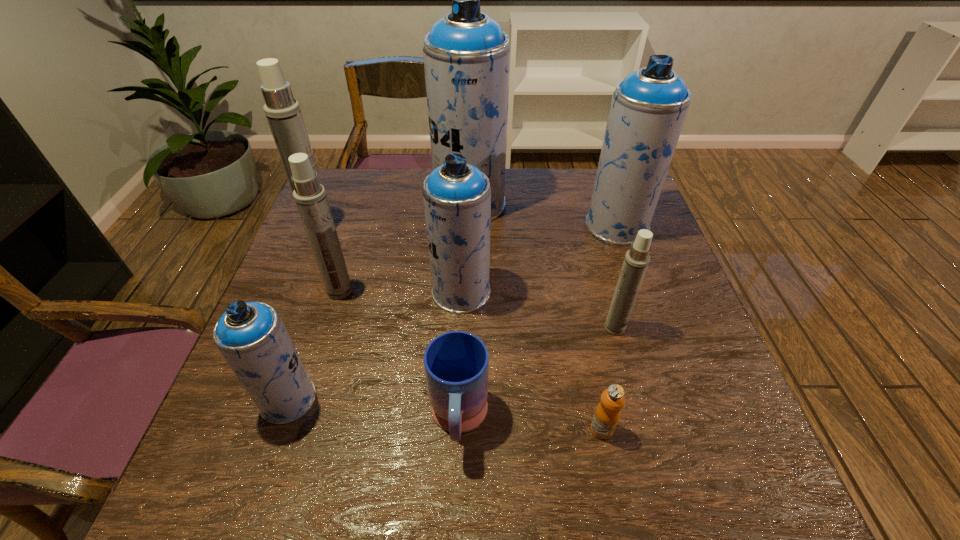
You are a GUI agent. You are given a task and a screenshot of the screen. Output one action in this format:
    pyautogui.click(x=<x>, y=<y>)
    Task: Click on the tallest aerosol can
    The image size is (960, 540).
    Given the screenshot: What is the action you would take?
    pyautogui.click(x=466, y=54)

Identify the location of the biggest blue aerosol can. (466, 54).

Find the location of a particular element. This screenshot has width=960, height=540. the farthest white aerosol can is located at coordinates (283, 113).

The width and height of the screenshot is (960, 540). What are the coordinates of `the leftmost white aerosol can` in the screenshot? It's located at (283, 113).

Locate an element on the screen. the second biggest blue aerosol can is located at coordinates (648, 109).

Find the location of `the second white aerosol can from left to right`. the second white aerosol can from left to right is located at coordinates (310, 197).

Where is `the second farthest white aerosol can`? The height and width of the screenshot is (540, 960). the second farthest white aerosol can is located at coordinates (310, 197).

The height and width of the screenshot is (540, 960). In order to click on the second smallest blue aerosol can in this screenshot , I will do `click(457, 196)`.

At what (x,y) coordinates should I click in order to perform the action: click on the smallest white aerosol can. Please return your answer as a coordinate pair (x, y). The height and width of the screenshot is (540, 960). Looking at the image, I should click on pos(636,261).

Where is `the second nearest aerosol can`? Image resolution: width=960 pixels, height=540 pixels. the second nearest aerosol can is located at coordinates (636, 261).